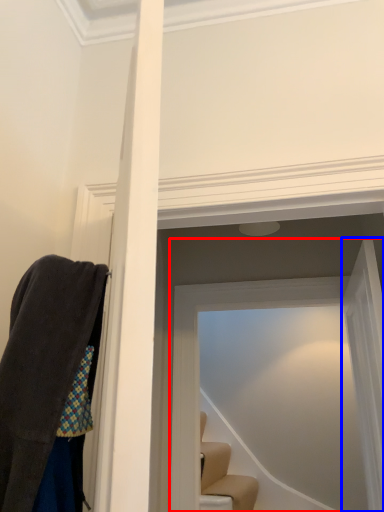
Question: Among these objects, which one is farthest to the camera, glass door (highlighted by a red box) or glass door (highlighted by a blue box)?

Choices:
 (A) glass door
 (B) glass door

Answer: (A)